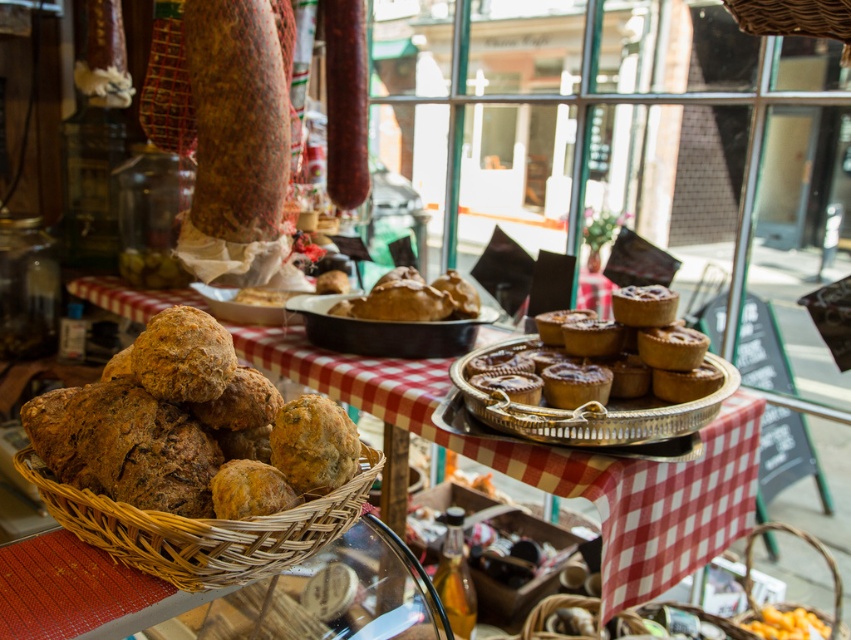
Question: Which object is the closest to the woven brown basket at lower right?

Choices:
 (A) brown rustic bread at lower left
 (B) golden brown pastry at center
 (C) wooden tray at center

Answer: (C)

Question: Which point is farther to the camera?

Choices:
 (A) woven brown basket at lower left
 (B) woven brown basket at lower right

Answer: (B)

Question: Does woven brown basket at lower left appear on the right side of woven brown basket at lower right?

Choices:
 (A) no
 (B) yes

Answer: (A)

Question: Does woven brown basket at lower left have a smaller size compared to woven brown basket at lower right?

Choices:
 (A) no
 (B) yes

Answer: (B)

Question: Which of the following is the closest to the observer?

Choices:
 (A) (590, 381)
 (B) (338, 384)
 (C) (193, 528)

Answer: (C)

Question: Does golden brown pastry at center appear under woven brown basket at lower right?

Choices:
 (A) yes
 (B) no

Answer: (B)